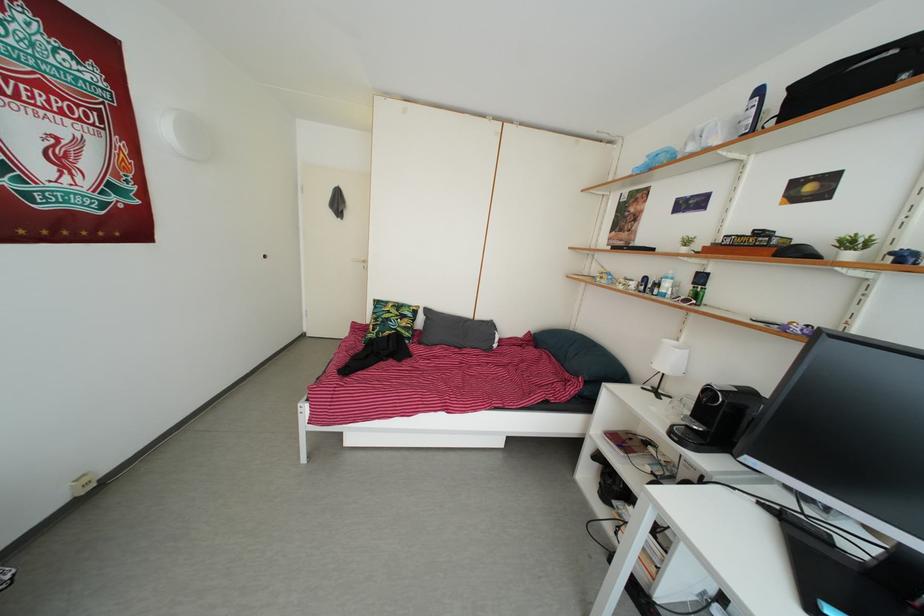
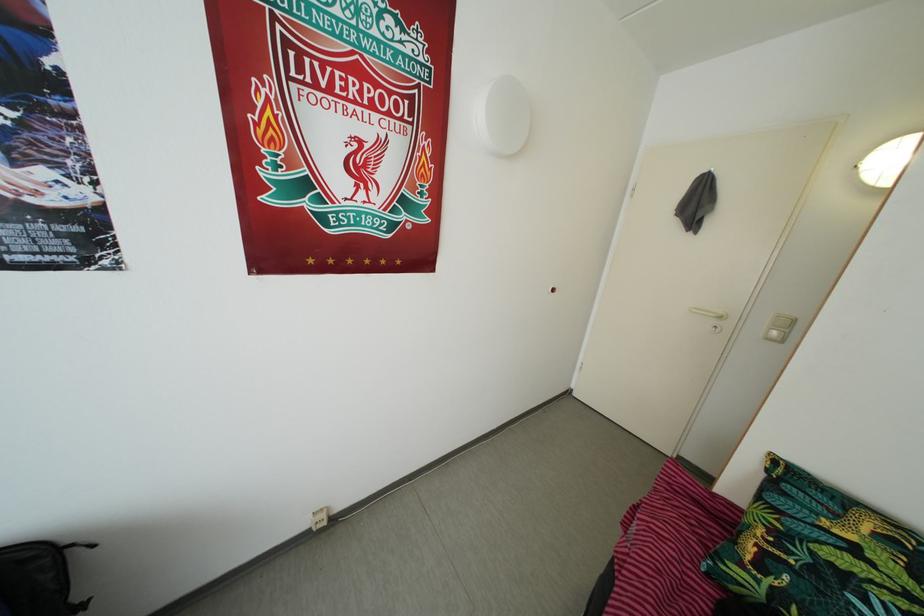
Find the pixel in the second image that matches point 388,330 in the first image.

(820, 578)